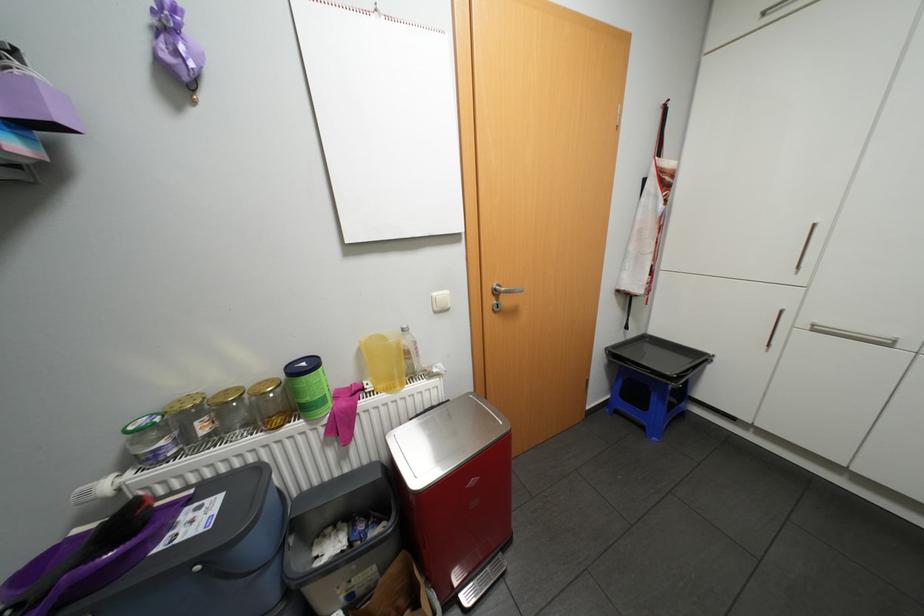
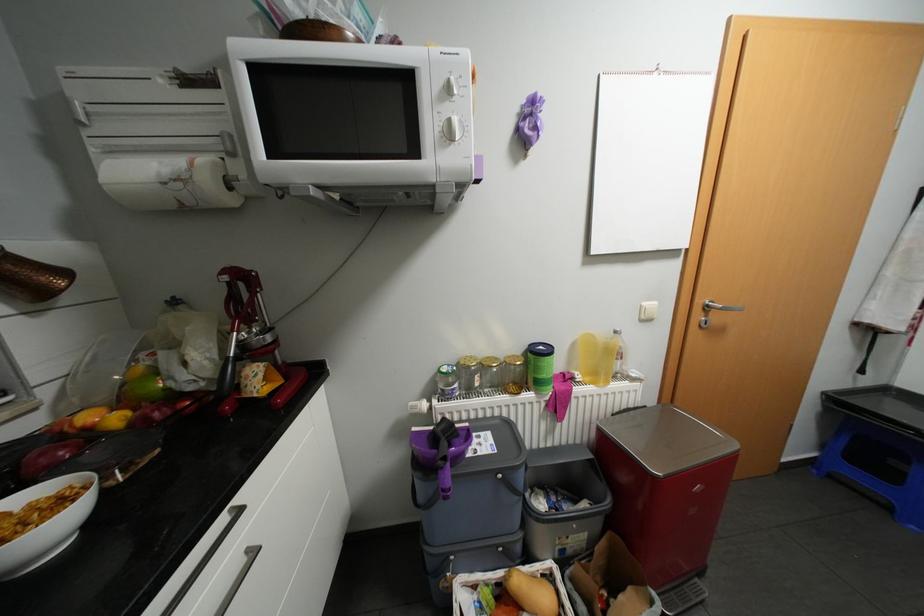
Locate, in the second image, the point that corresponds to pixel 235 389 in the first image.

(495, 357)